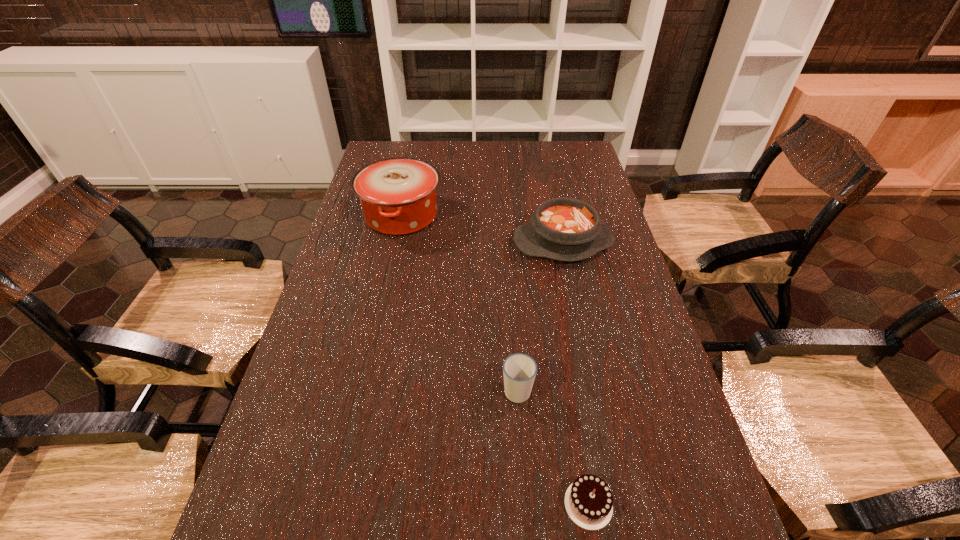
Locate an element on the screen. the left casserole is located at coordinates (398, 195).

Where is `the leftmost object`? The image size is (960, 540). the leftmost object is located at coordinates (398, 195).

You are a GUI agent. You are given a task and a screenshot of the screen. Output one action in this format:
    pyautogui.click(x=<x>, y=<y>)
    Task: Click on the shorter casserole
    The height and width of the screenshot is (540, 960).
    Given the screenshot: What is the action you would take?
    pos(565,229)

Identify the location of cup. This screenshot has width=960, height=540. (519, 370).

Image resolution: width=960 pixels, height=540 pixels. I want to click on chocolate cake, so click(588, 500).

You are a GUI agent. You are given a task and a screenshot of the screen. Output one action in this format:
    pyautogui.click(x=<x>, y=<y>)
    Task: Click on the shortest object
    Image resolution: width=960 pixels, height=540 pixels.
    Given the screenshot: What is the action you would take?
    click(x=588, y=500)

Identify the location of free space located 0.200m on the back of the leftmost object. (413, 163).

Find the location of a particular element. The width and height of the screenshot is (960, 540). vacant space located 0.050m on the left of the shorter casserole is located at coordinates (497, 242).

Image resolution: width=960 pixels, height=540 pixels. I want to click on vacant space located 0.100m with a handle on the side of the cup, so click(514, 340).

Find the location of a particular element. This screenshot has height=540, width=960. vacant space located 0.250m with a handle on the side of the cup is located at coordinates (511, 298).